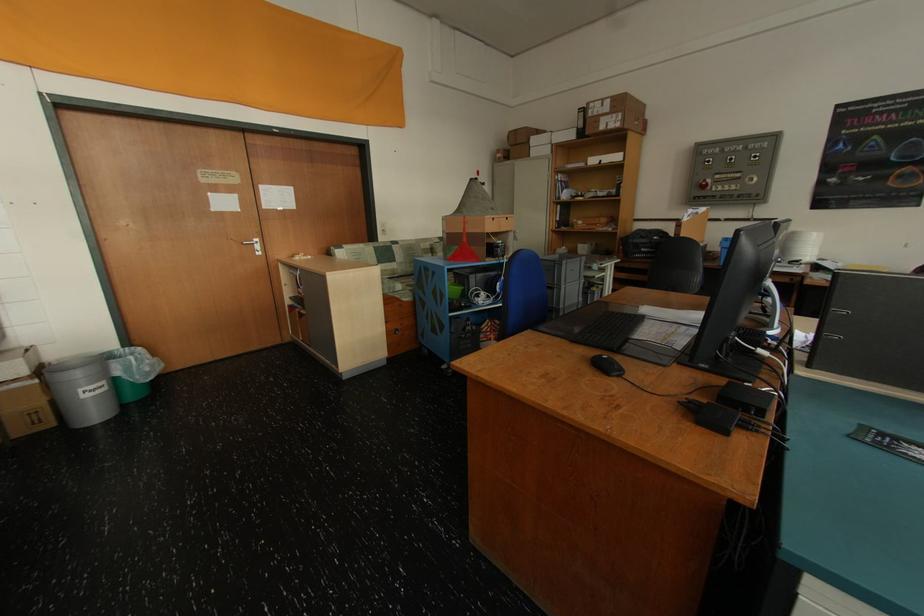
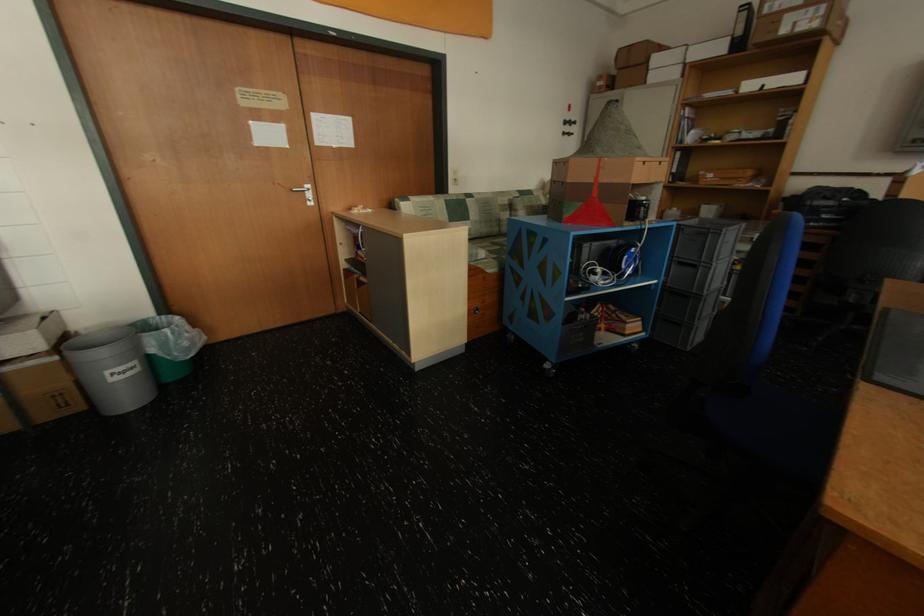
Where in the second image is the point corresponding to (x=262, y=245) from the first image?

(312, 192)